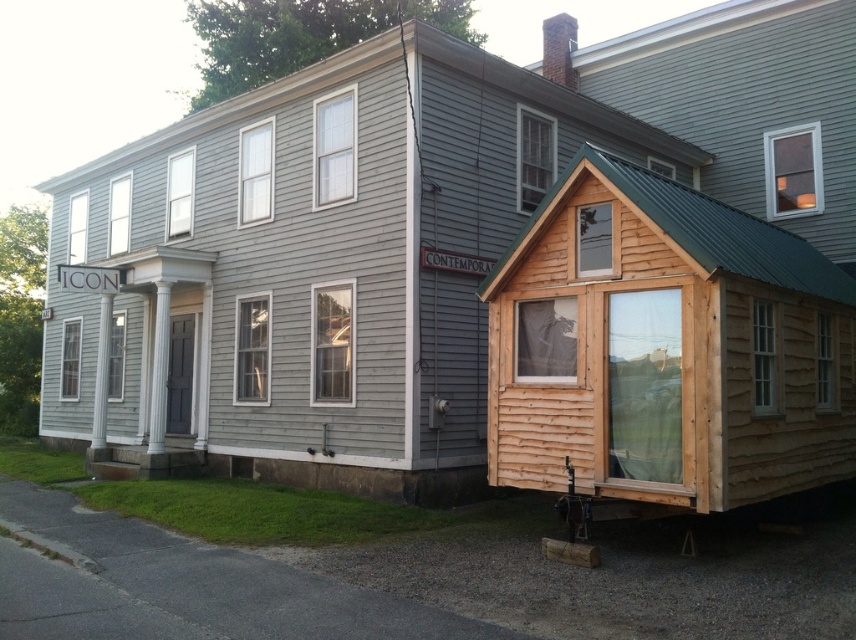
You are standing in front of the two buildings. Which cabin is located to the left when comparing the natural wood cabin at right and the wooden cabin at upper right?

The natural wood cabin at right is located to the left of the wooden cabin at upper right.

You are standing at the entrance of the main building and want to walk to the natural wood cabin at right. What direction should you head?

Since the natural wood cabin at right is located at point 0.366 on the x axis and 0.468 on the y axis, you should head to the right direction from the entrance of the main building.